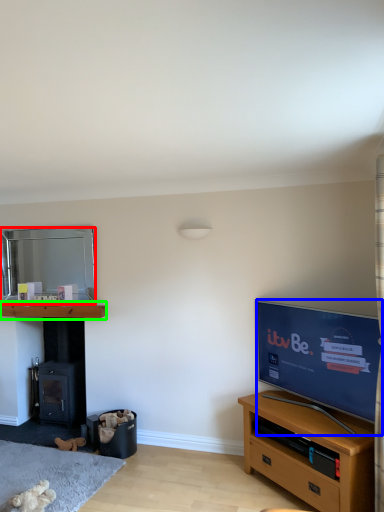
Question: Estimate the real-world distances between objects in this image. Which object is closer to mirror (highlighted by a red box), television (highlighted by a blue box) or shelf (highlighted by a green box)?

Choices:
 (A) television
 (B) shelf

Answer: (B)